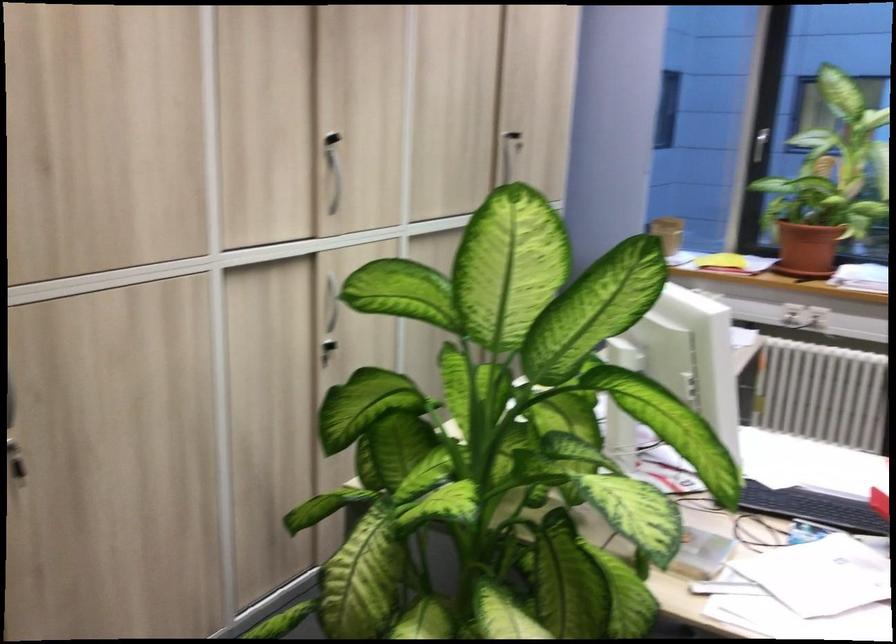
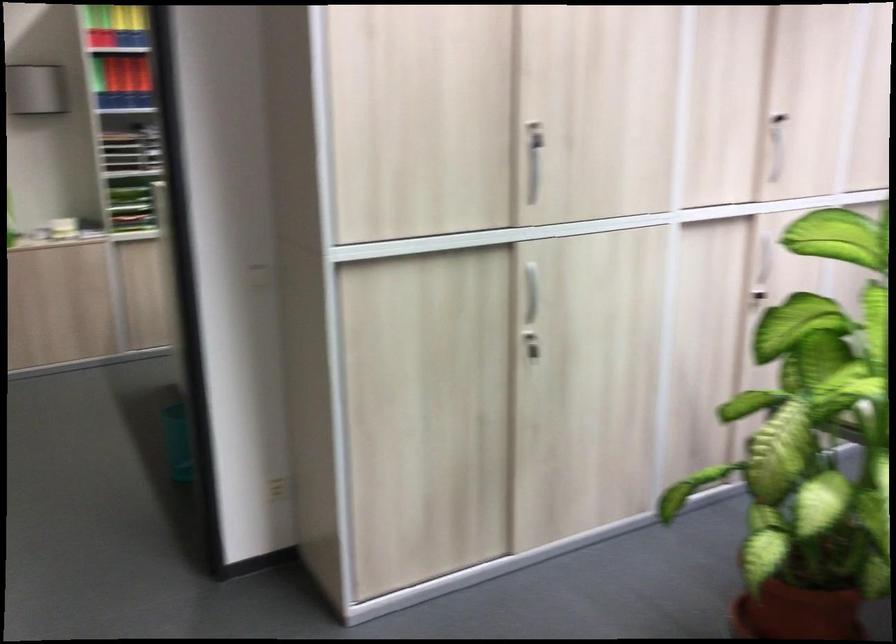
Question: The camera is either moving clockwise (left) or counter-clockwise (right) around the object. The first image is from the beginning of the video and the second image is from the end. Is the camera moving left or right when shooting the video?

Choices:
 (A) Left
 (B) Right

Answer: (B)